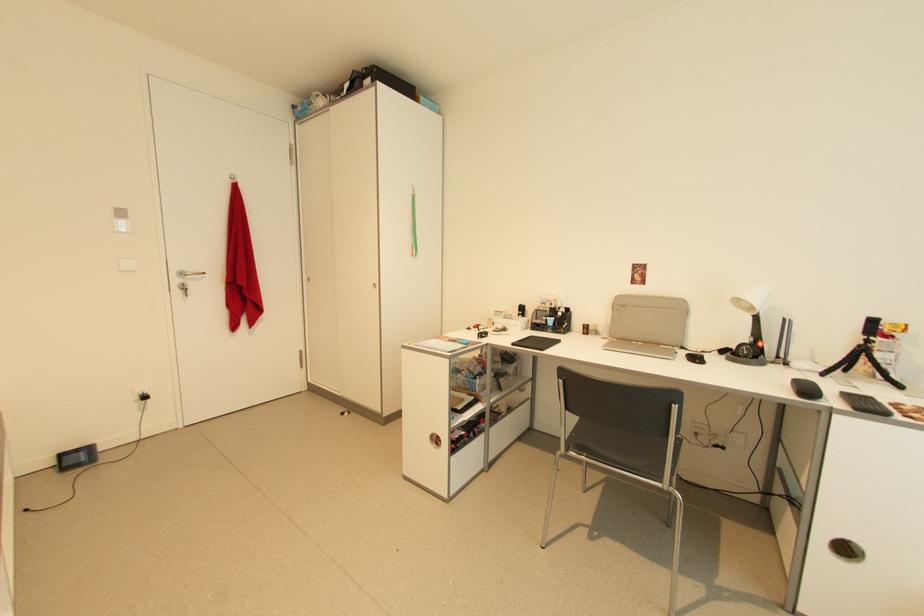
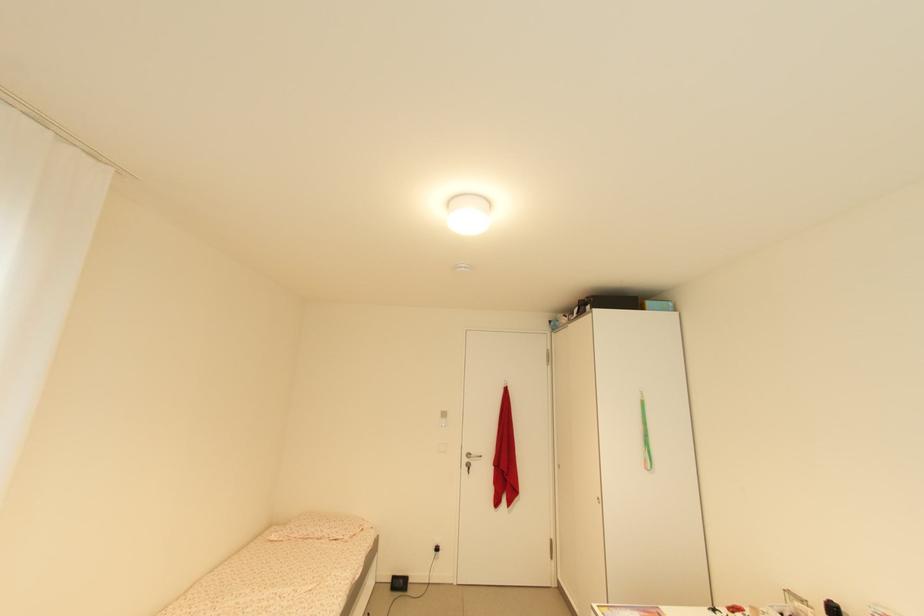
Locate, in the second image, the point that corresponds to the point at 180,283 in the first image.

(470, 461)